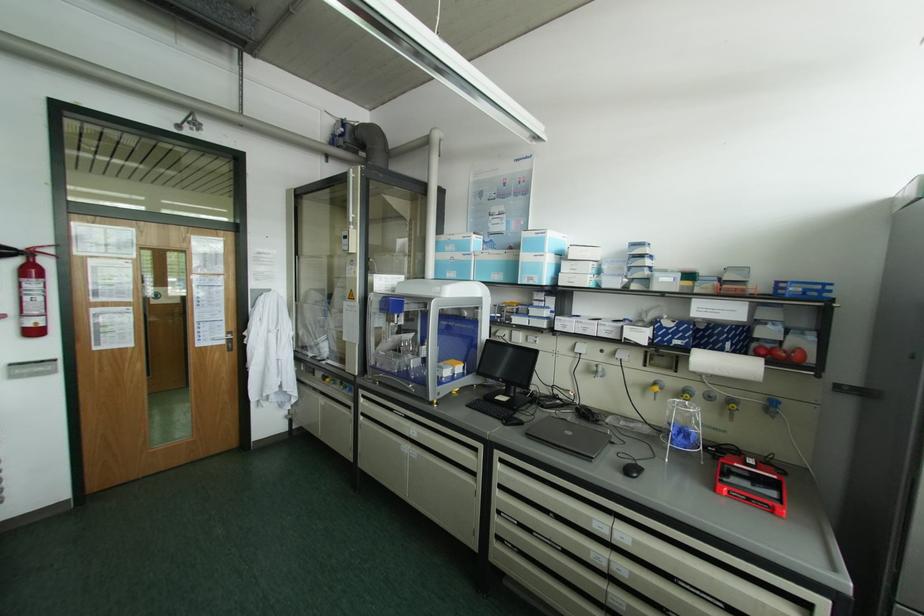
Where would you click the black computer mouse? Please return your answer as a coordinate pair (x, y).

(631, 469)